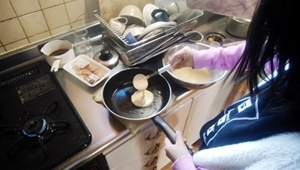
The height and width of the screenshot is (170, 300). Find the location of `gas stove grate`. gas stove grate is located at coordinates (63, 121).